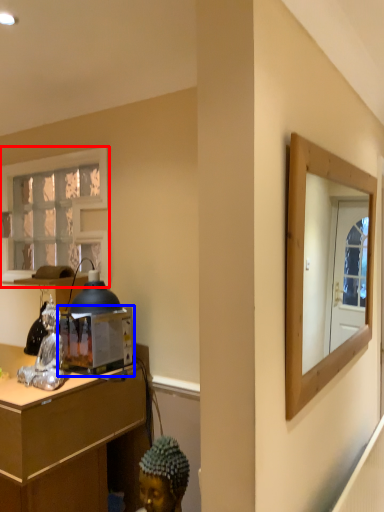
Question: Which point is further to the camera, window (highlighted by a red box) or appliance (highlighted by a blue box)?

Choices:
 (A) window
 (B) appliance

Answer: (A)